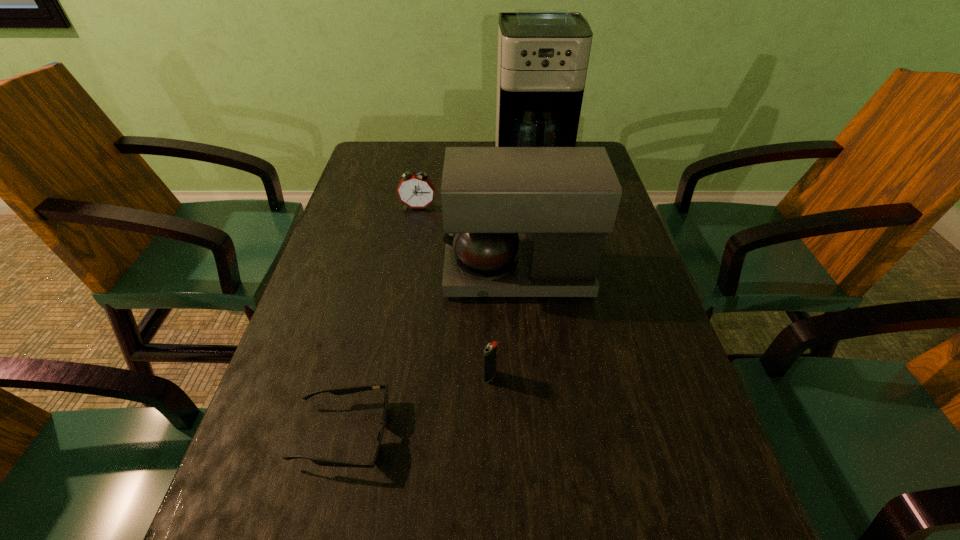
At what (x,y) coordinates should I click in order to perform the action: click on the farther coffee maker. Please return your answer as a coordinate pair (x, y). Looking at the image, I should click on (543, 54).

Identify the location of the farthest object. This screenshot has height=540, width=960. (543, 54).

Identify the location of the third nearest object. (565, 199).

Locate an element on the screen. The height and width of the screenshot is (540, 960). the nearer coffee maker is located at coordinates (565, 199).

Where is `the fourth nearest object`? This screenshot has width=960, height=540. the fourth nearest object is located at coordinates click(x=416, y=191).

You are a GUI agent. You are given a task and a screenshot of the screen. Output one action in this format:
    pyautogui.click(x=<x>, y=<y>)
    Task: Click on the alarm clock
    Image resolution: width=960 pixels, height=540 pixels.
    Given the screenshot: What is the action you would take?
    pyautogui.click(x=416, y=191)

At what (x,y) coordinates should I click in order to perform the action: click on the second nearest object. Please return your answer as a coordinate pair (x, y). Looking at the image, I should click on (490, 350).

This screenshot has height=540, width=960. Identify the location of the second shortest object. (490, 350).

Find the location of `the shortest object`. the shortest object is located at coordinates (354, 389).

Locate an element on the screen. the nearest object is located at coordinates (354, 389).